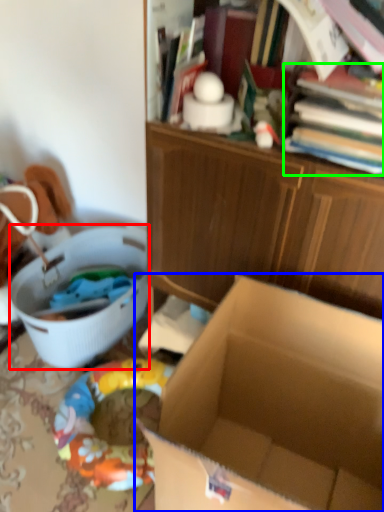
Question: Which object is the farthest from laundry basket (highlighted by a red box)? Choose among these: box (highlighted by a blue box) or book (highlighted by a green box).

Choices:
 (A) box
 (B) book

Answer: (B)